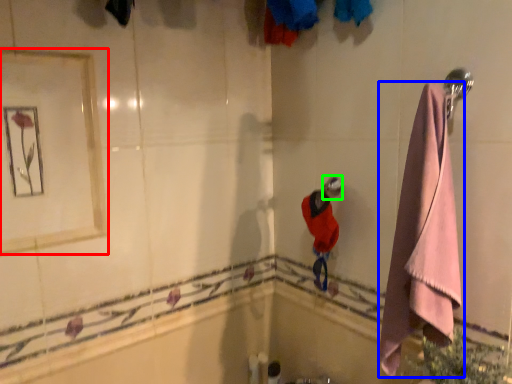
Question: Based on their relative distances, which object is nearer to mirror (highlighted by a red box)? Choose from towel (highlighted by a blue box) and shower (highlighted by a green box).

Choices:
 (A) towel
 (B) shower

Answer: (B)